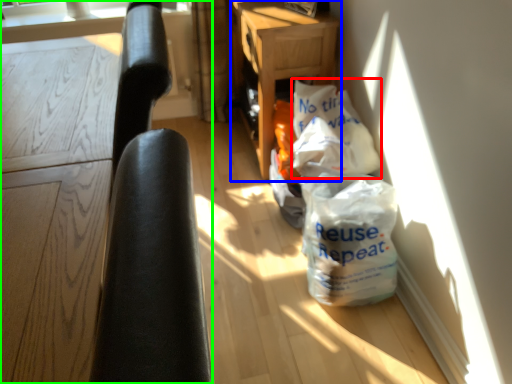
Question: Which object is positioned farthest from grocery bag (highlighted by a red box)? Select from table (highlighted by a blue box) and furniture (highlighted by a green box).

Choices:
 (A) table
 (B) furniture

Answer: (B)